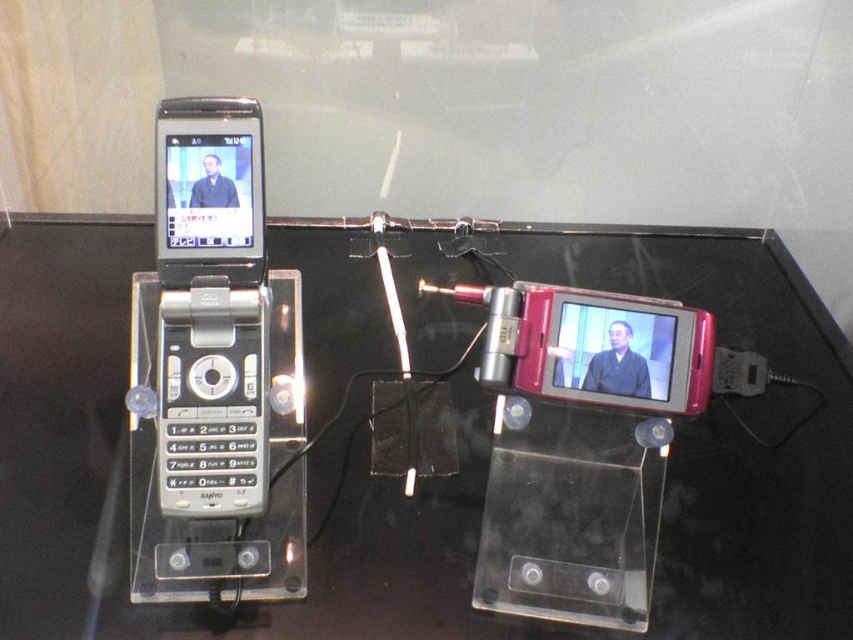
You are a museum curator arranging an exhibit. You have a matte black flip phone at left that needs to be placed on the black glossy glass table at center. Considering their heights, will the phone be visible above the table?

The black glossy glass table at center is much taller than the matte black flip phone at left, so the phone will not be visible above the table since it is shorter.

You are a curator at a museum and need to place a new exhibit label. The label must be placed at point (735, 432). Where should you place the label?

The label should be placed at the black glossy glass table at center, as point (735, 432) corresponds to this location.

You are a museum guide explaining the exhibit. You point to the black glossy glass table at center and the matte black flip phone at left. Which object is positioned lower in the scene?

The black glossy glass table at center is positioned lower than the matte black flip phone at left, as it is located below it.